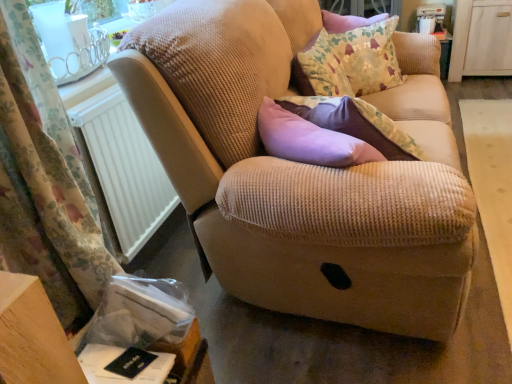
Image resolution: width=512 pixels, height=384 pixels. What do you see at coordinates (122, 170) in the screenshot? I see `white plastic radiator at left` at bounding box center [122, 170].

Identify the location of beige corduroy couch at center. The image size is (512, 384). (302, 173).

Where is `white plastic radiator at left`? This screenshot has width=512, height=384. white plastic radiator at left is located at coordinates (122, 170).

From a real-world perspective, which object rests below the other?

In real-world perspective, white plastic radiator at left is lower.

Does point (123, 109) come farther from viewer compared to point (88, 211)?

Yes.

Is the depth of white plastic radiator at left greater than that of floral fabric curtain at left?

Yes, white plastic radiator at left is further from the camera.

Between white plastic radiator at left and floral fabric curtain at left, which one has more height?

floral fabric curtain at left is taller.

Which object is positioned more to the left, floral fabric curtain at left or beige corduroy couch at center?

floral fabric curtain at left is more to the left.

Locate an element on the screen. This screenshot has width=512, height=384. curtain lying below the beige corduroy couch at center (from the image's perspective) is located at coordinates (45, 205).

Is floral fabric curtain at left not close to beige corduroy couch at center?

No, floral fabric curtain at left is in close proximity to beige corduroy couch at center.

Is floral fabric cushion at upper right at the back of floral fabric curtain at left?

No.

Considering the relative sizes of floral fabric curtain at left and floral fabric cushion at upper right in the image provided, is floral fabric curtain at left taller than floral fabric cushion at upper right?

Indeed, floral fabric curtain at left has a greater height compared to floral fabric cushion at upper right.

From a real-world perspective, which is physically below, floral fabric curtain at left or floral fabric cushion at upper right?

floral fabric curtain at left is physically lower.

Considering the positions of point (90, 280) and point (304, 88), is point (90, 280) closer or farther from the camera than point (304, 88)?

Point (90, 280).

Based on the photo, between floral fabric cushion at upper right and floral fabric curtain at left, which one is positioned in front?

floral fabric curtain at left is closer to the camera.

How many degrees apart are the facing directions of floral fabric cushion at upper right and floral fabric curtain at left?

64.5 degrees.

In order to click on curtain in front of the floral fabric cushion at upper right in this screenshot , I will do `click(45, 205)`.

Which object is positioned more to the right, floral fabric cushion at upper right or floral fabric curtain at left?

floral fabric cushion at upper right is more to the right.

Considering the sizes of objects white plastic radiator at left and floral fabric cushion at upper right in the image provided, who is wider, white plastic radiator at left or floral fabric cushion at upper right?

Wider between the two is floral fabric cushion at upper right.

Considering the positions of points (97, 128) and (353, 69), is point (97, 128) closer to camera compared to point (353, 69)?

Yes, it is.

Based on the photo, is white plastic radiator at left oriented towards floral fabric cushion at upper right?

No.

From a real-world perspective, relative to floral fabric cushion at upper right, is white plastic radiator at left vertically above or below?

In terms of real-world spatial position, white plastic radiator at left is below floral fabric cushion at upper right.

The width and height of the screenshot is (512, 384). Identify the location of curtain in front of the white plastic radiator at left. (45, 205).

Who is smaller, floral fabric curtain at left or white plastic radiator at left?

white plastic radiator at left.

Between floral fabric curtain at left and white plastic radiator at left, which one appears on the right side from the viewer's perspective?

white plastic radiator at left.

Relative to white plastic radiator at left, is floral fabric curtain at left in front or behind?

Answer: Visually, floral fabric curtain at left is located in front of white plastic radiator at left.

Between white plastic radiator at left and beige corduroy couch at center, which one has more height?

beige corduroy couch at center is taller.

Considering the points (135, 222) and (242, 266), which point is behind, point (135, 222) or point (242, 266)?

The point (135, 222) is more distant.

Can beige corduroy couch at center be found inside white plastic radiator at left?

Actually, beige corduroy couch at center is outside white plastic radiator at left.

Can you confirm if white plastic radiator at left is smaller than beige corduroy couch at center?

Yes.

Locate an element on the screen. The image size is (512, 384). curtain on the left of the white plastic radiator at left is located at coordinates (45, 205).

Where is `curtain located in front of the beige corduroy couch at center`? Image resolution: width=512 pixels, height=384 pixels. curtain located in front of the beige corduroy couch at center is located at coordinates (45, 205).

Estimate the real-world distances between objects in this image. Which object is closer to white wood dresser at upper right, beige corduroy couch at center or floral fabric curtain at left?

beige corduroy couch at center is positioned closer to the anchor white wood dresser at upper right.

Based on their spatial positions, is beige corduroy couch at center or floral fabric curtain at left further from floral fabric cushion at upper right?

floral fabric curtain at left lies further to floral fabric cushion at upper right than the other object.

Considering their positions, is white wood dresser at upper right positioned further to beige corduroy couch at center than white plastic radiator at left?

white wood dresser at upper right is further to beige corduroy couch at center.

Looking at this image, from the image, which object appears to be nearer to beige corduroy couch at center, floral fabric cushion at upper right or floral fabric curtain at left?

floral fabric curtain at left.

Estimate the real-world distances between objects in this image. Which object is closer to white plastic radiator at left, beige corduroy couch at center or floral fabric cushion at upper right?

beige corduroy couch at center lies closer to white plastic radiator at left than the other object.

Based on their spatial positions, is floral fabric cushion at upper right or white wood dresser at upper right further from floral fabric curtain at left?

The object further to floral fabric curtain at left is white wood dresser at upper right.

Which object lies further to the anchor point white plastic radiator at left, floral fabric curtain at left or beige corduroy couch at center?

beige corduroy couch at center lies further to white plastic radiator at left than the other object.

Based on their spatial positions, is floral fabric curtain at left or beige corduroy couch at center further from floral fabric cushion at upper right?

Based on the image, floral fabric curtain at left appears to be further to floral fabric cushion at upper right.

In order to click on throw pillow between floral fabric curtain at left and white wood dresser at upper right from left to right in this screenshot , I will do `click(349, 58)`.

Identify the location of radiator between floral fabric curtain at left and beige corduroy couch at center from left to right. (122, 170).

In order to click on radiator positioned between beige corduroy couch at center and white wood dresser at upper right from near to far in this screenshot , I will do `click(122, 170)`.

Where is `radiator between floral fabric curtain at left and floral fabric cushion at upper right along the z-axis`? The width and height of the screenshot is (512, 384). radiator between floral fabric curtain at left and floral fabric cushion at upper right along the z-axis is located at coordinates (122, 170).